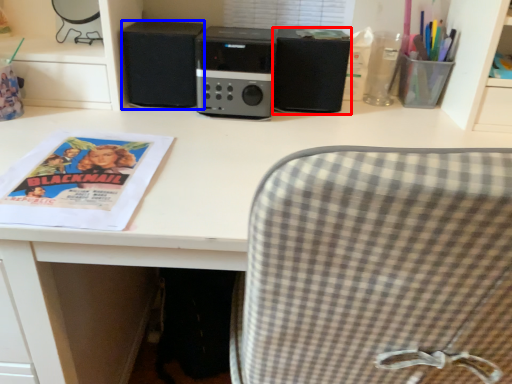
Question: Which of the following is the closest to the observer, speaker (highlighted by a red box) or speaker (highlighted by a blue box)?

Choices:
 (A) speaker
 (B) speaker

Answer: (A)